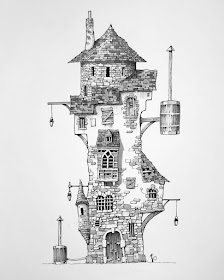
Locate an element on the screen. chimney is located at coordinates (89, 12).